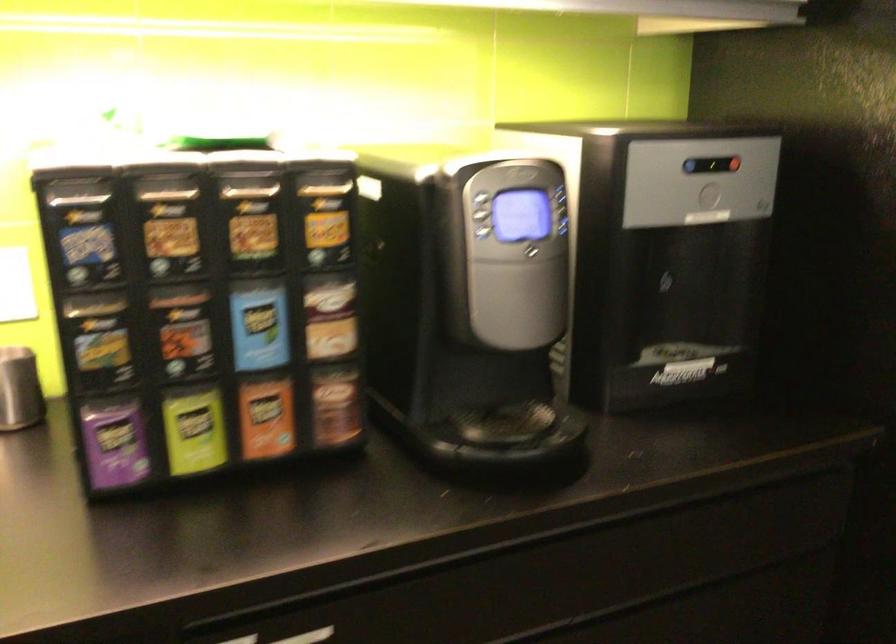
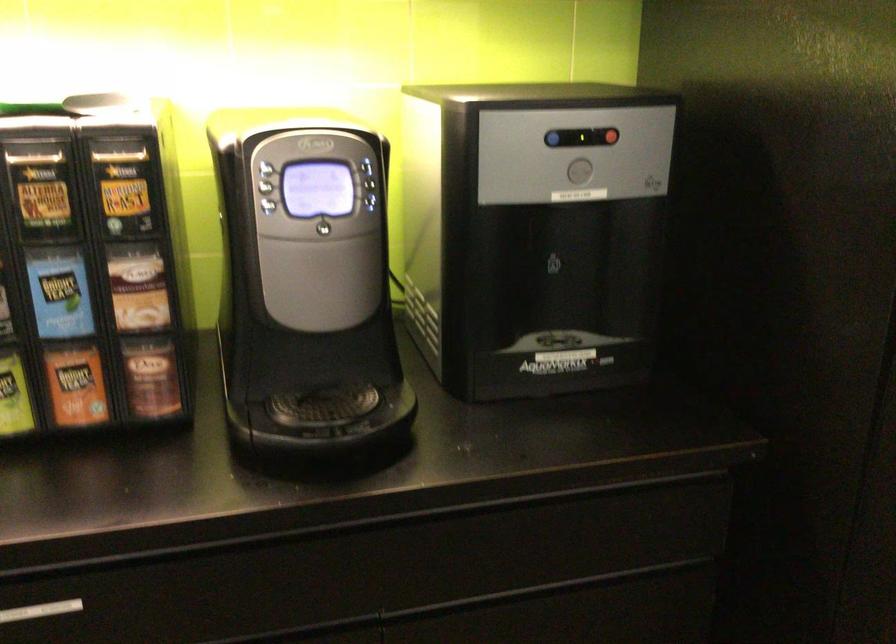
Find the pixel in the second image that matches (x=328, y=218) in the first image.

(125, 185)